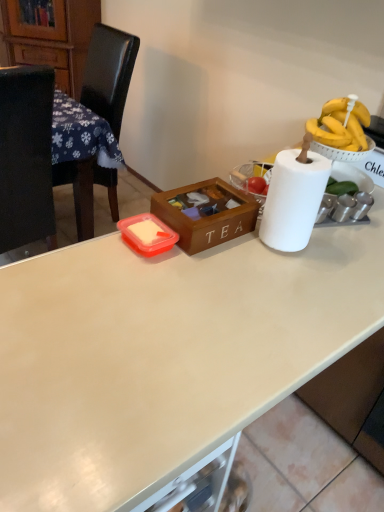
Question: From a real-world perspective, is white matte desk at center located beneath black leather chair at left?

Choices:
 (A) no
 (B) yes

Answer: (B)

Question: Does white matte desk at center have a larger size compared to black leather chair at left?

Choices:
 (A) no
 (B) yes

Answer: (B)

Question: Does white matte desk at center have a smaller size compared to black leather chair at left?

Choices:
 (A) yes
 (B) no

Answer: (B)

Question: Is white matte desk at center wider than black leather chair at left?

Choices:
 (A) yes
 (B) no

Answer: (A)

Question: Is white matte desk at center not inside black leather chair at left?

Choices:
 (A) yes
 (B) no

Answer: (A)

Question: Is white matte desk at center looking in the opposite direction of black leather chair at left?

Choices:
 (A) yes
 (B) no

Answer: (B)

Question: Is white matte table at left closer to the viewer compared to wooden cabinet at left?

Choices:
 (A) yes
 (B) no

Answer: (A)

Question: Considering the relative sizes of white matte table at left and wooden cabinet at left in the image provided, is white matte table at left taller than wooden cabinet at left?

Choices:
 (A) yes
 (B) no

Answer: (A)

Question: Does white matte table at left have a greater width compared to wooden cabinet at left?

Choices:
 (A) yes
 (B) no

Answer: (A)

Question: Is white matte table at left aimed at wooden cabinet at left?

Choices:
 (A) no
 (B) yes

Answer: (A)

Question: Does white matte table at left lie behind wooden cabinet at left?

Choices:
 (A) yes
 (B) no

Answer: (B)

Question: Can you confirm if white matte table at left is positioned to the right of wooden cabinet at left?

Choices:
 (A) no
 (B) yes

Answer: (B)

Question: From the image's perspective, is black leather chair at left located beneath white matte desk at center?

Choices:
 (A) no
 (B) yes

Answer: (A)